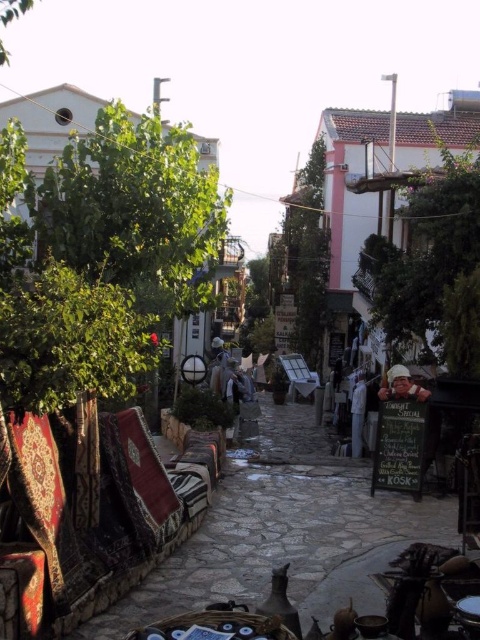
You are a delivery person standing at the matte khaki helmet at center in the narrow street scene. You need to deliver a package to the green leafy tree at center. The delivery robot you use has a maximum range of 20 meters. Can the robot reach the tree from your current position?

The green leafy tree at center is 21.10 meters from matte khaki helmet at center. Since the robot has a maximum range of 20 meters, it cannot reach the tree from the current position.

You are standing at the point indicated by the coordinates point (308, 253) in the image. What object is directly in front of you?

The green leafy tree at center is directly in front of you at the coordinates point (308, 253).